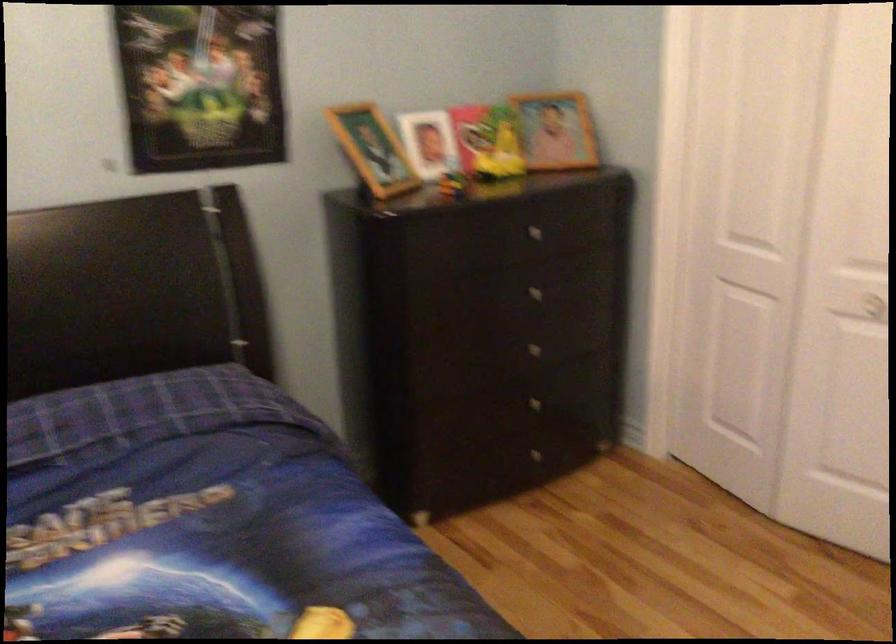
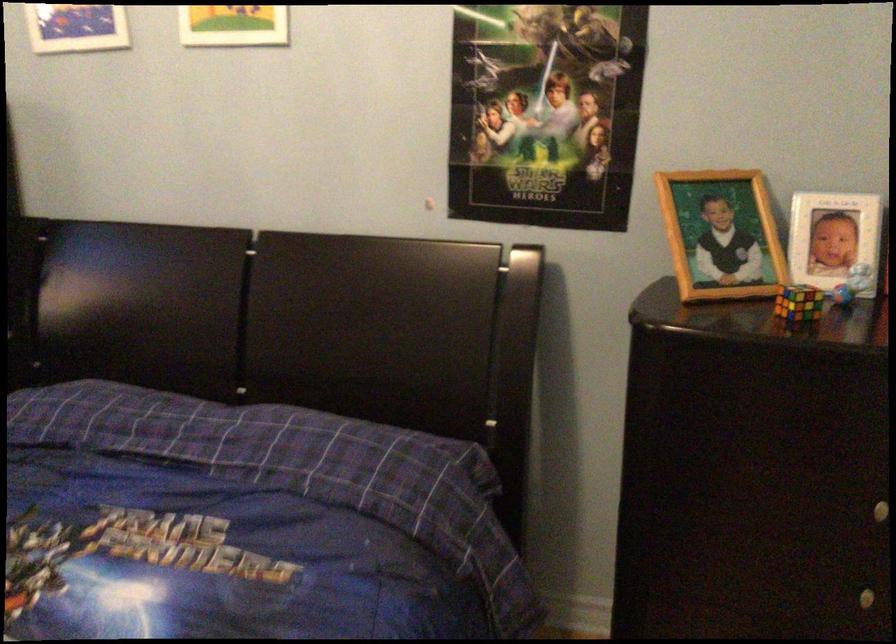
In the second image, find the point that corresponds to (538,348) in the first image.

(868, 597)